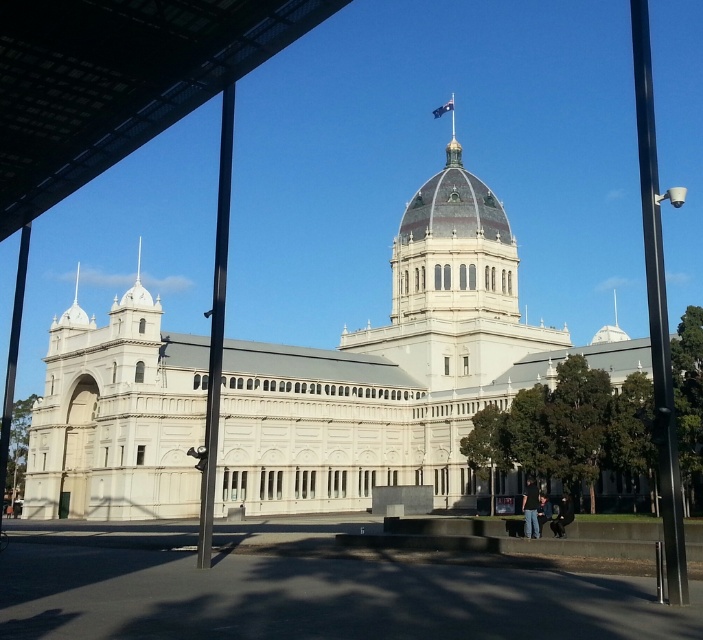
You are a photographer planning to take a photo of the historic building with the dome and Australian flag. You notice two black metal poles in the foreground. Which pole, the black metal pole at center or the black metal pole at left, would be easier to avoid blocking the dome in your photo?

The black metal pole at center is thinner than the black metal pole at left, so it would be easier to avoid blocking the dome in your photo by moving around it since it takes up less space.

You are a visitor standing in front of the historic building and notice the dark gray metal canopy at upper center and the black metal pole at center. Which object is positioned more to the right side from your viewpoint?

The dark gray metal canopy at upper center is positioned more to the right side from your viewpoint compared to the black metal pole at center.

You are a photographer trying to capture the grandeur of the white stone building at center. However, there is a black metal pole at left blocking part of the view. Based on their sizes, which object would you need to move closer to or farther away from to ensure the pole doesn not obstruct the building?

Since the white stone building at center is larger than the black metal pole at left, you should move closer to the building. This will make the building appear even larger in your frame, potentially reducing the prominence of the pole in the foreground and allowing the building to dominate the shot without obstruction.